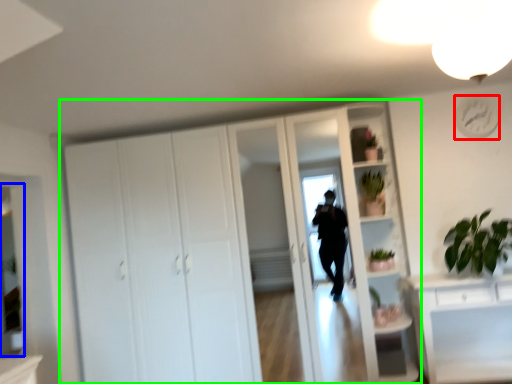
Question: Considering the real-world distances, which object is farthest from clock (highlighted by a red box)? mirror (highlighted by a blue box) or cupboard (highlighted by a green box)?

Choices:
 (A) mirror
 (B) cupboard

Answer: (A)